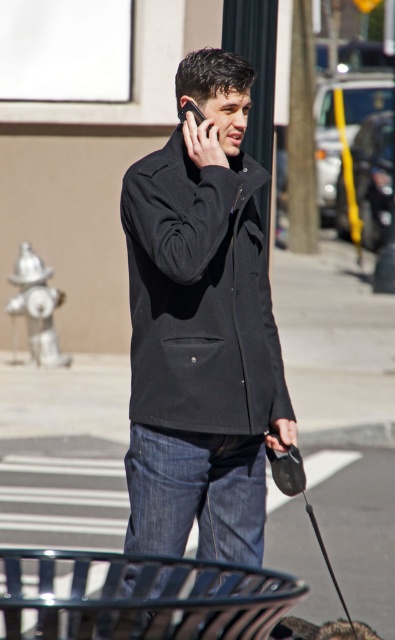
Question: Which is farther from the black matte jacket at center?

Choices:
 (A) silver metallic fire hydrant at lower left
 (B) matte black phone at upper center
 (C) brown fur dog at lower center

Answer: (A)

Question: Is silver metallic fire hydrant at lower left further to the viewer compared to matte black phone at upper center?

Choices:
 (A) yes
 (B) no

Answer: (A)

Question: Which object is positioned farthest from the silver metallic fire hydrant at lower left?

Choices:
 (A) black matte jacket at center
 (B) brown fur dog at lower center
 (C) matte black phone at upper center

Answer: (C)

Question: Is silver metallic fire hydrant at lower left positioned in front of matte black phone at upper center?

Choices:
 (A) yes
 (B) no

Answer: (B)

Question: Does black matte jacket at center have a smaller size compared to silver metallic fire hydrant at lower left?

Choices:
 (A) no
 (B) yes

Answer: (A)

Question: Which point is farther to the camera?

Choices:
 (A) matte black phone at upper center
 (B) black matte jacket at center
 (C) brown fur dog at lower center
 (D) silver metallic fire hydrant at lower left

Answer: (D)